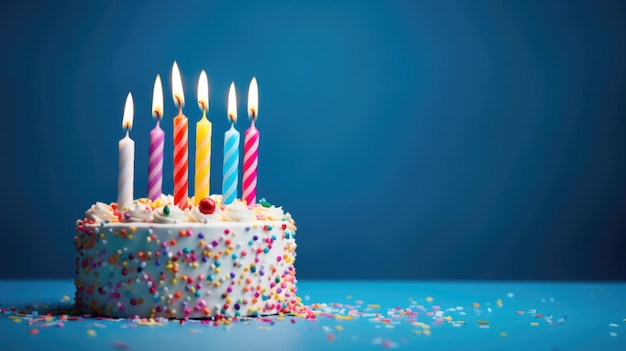
At what (x,y) coordinates should I click in order to perform the action: click on birthday candles. Please return your answer as a coordinate pair (x, y). Looking at the image, I should click on (128, 157), (151, 150), (181, 140), (203, 142), (233, 140), (250, 145).